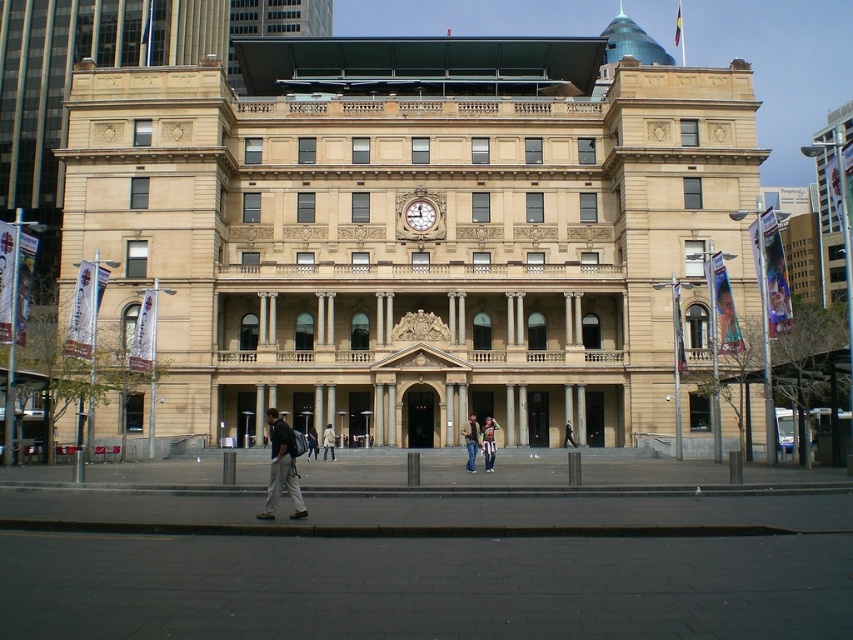
You are standing at the entrance of the classical building and looking towards the street. Where exactly can you spot the dark gray fabric pants at lower left?

The dark gray fabric pants at lower left can be found at point (281, 467).

Based on the photo, you are a photographer standing in front of the classical building. You notice a person wearing a denim jacket at center and striped fabric pants at center. Which clothing item is located to the left when viewed from your perspective?

The denim jacket at center is positioned on the left side of striped fabric pants at center, so it is located to the left when viewed from your perspective.